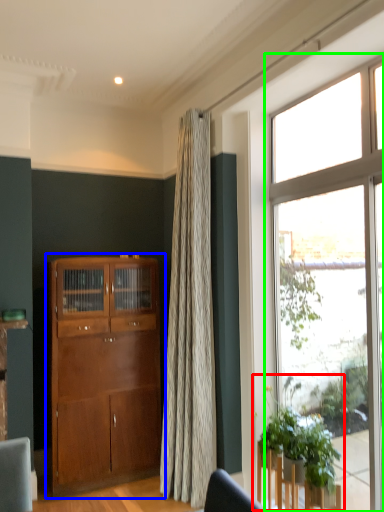
Question: Considering the real-world distances, which object is closest to houseplant (highlighted by a red box)? cabinetry (highlighted by a blue box) or window (highlighted by a green box).

Choices:
 (A) cabinetry
 (B) window

Answer: (B)